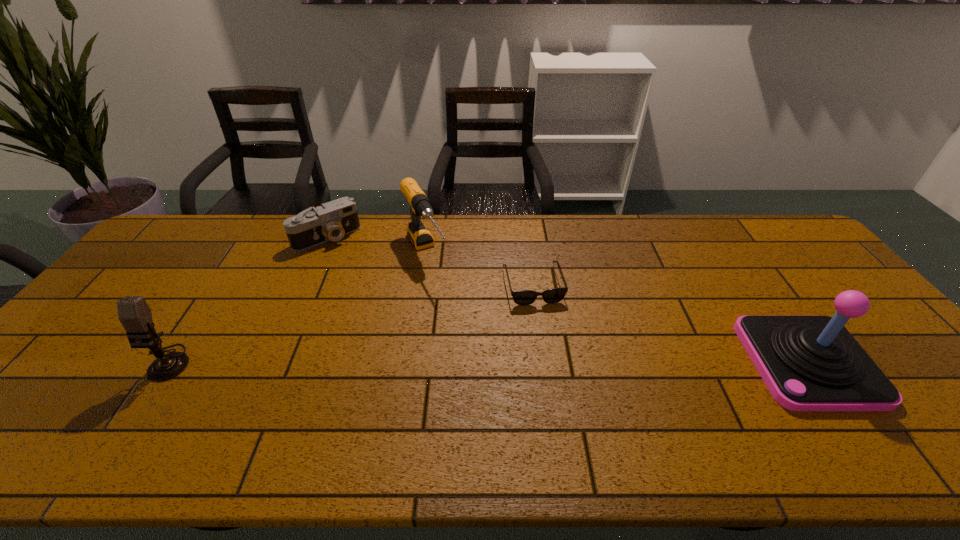
The height and width of the screenshot is (540, 960). Find the location of `vacant space located 0.310m at the front lenses of the sunglasses`. vacant space located 0.310m at the front lenses of the sunglasses is located at coordinates (565, 400).

What are the coordinates of `free space located at the front lenses of the sunglasses` in the screenshot? It's located at (553, 356).

Identify the location of free space located at the front lenses of the sunglasses. Image resolution: width=960 pixels, height=540 pixels. (571, 420).

Identify the location of vacant space situated 0.190m on the handle side of the third object from left to right. The image size is (960, 540). (458, 322).

At what (x,y) coordinates should I click in order to perform the action: click on free space located on the handle side of the third object from left to right. Please return your answer as a coordinate pair (x, y). The height and width of the screenshot is (540, 960). Looking at the image, I should click on (458, 322).

Find the location of a particular element. vacant space located 0.100m on the handle side of the third object from left to right is located at coordinates (445, 301).

The width and height of the screenshot is (960, 540). Identify the location of vacant region located 0.400m on the lens of the second object from left to right. (400, 320).

You are a GUI agent. You are given a task and a screenshot of the screen. Output one action in this format:
    pyautogui.click(x=<x>, y=<y>)
    Task: Click on the vacant region located 0.080m on the lens of the second object from left to right
    The image size is (960, 540).
    Given the screenshot: What is the action you would take?
    pyautogui.click(x=351, y=261)

I want to click on free space located on the lens of the second object from left to right, so pos(357,267).

Where is `drill located at the far edge`? The width and height of the screenshot is (960, 540). drill located at the far edge is located at coordinates (420, 236).